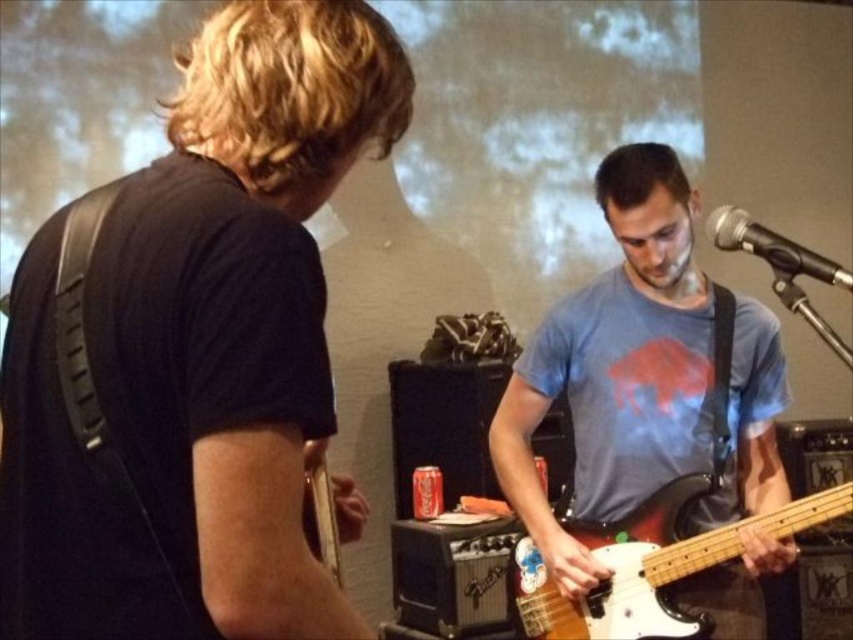
Locate an element on the screen. wooden electric bass at center is located at coordinates (648, 564).

Who is more forward, [323,36] or [659,513]?

Positioned in front is point [323,36].

Between black matte guitar at left and wooden electric bass at center, which one is positioned higher?

black matte guitar at left is above.

Locate an element on the screen. Image resolution: width=853 pixels, height=640 pixels. black matte guitar at left is located at coordinates (192, 349).

Can you confirm if blue cotton t-shirt at center is positioned below metallic silver microphone at upper right?

Yes, blue cotton t-shirt at center is below metallic silver microphone at upper right.

Between point (776, 336) and point (775, 257), which one is positioned in front?

Positioned in front is point (775, 257).

Does point (641, 419) come closer to viewer compared to point (724, 237)?

No, (641, 419) is behind (724, 237).

Locate an element on the screen. blue cotton t-shirt at center is located at coordinates (618, 365).